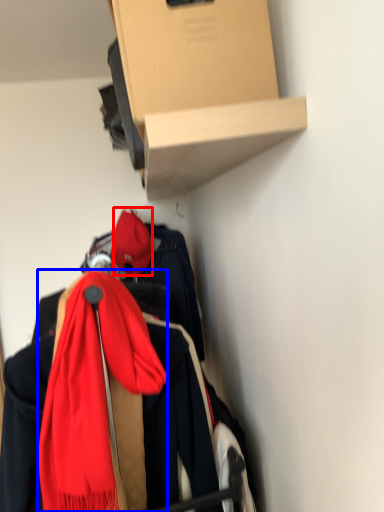
Question: Which point is closer to the camera, hat (highlighted by a red box) or scarf (highlighted by a blue box)?

Choices:
 (A) hat
 (B) scarf

Answer: (B)